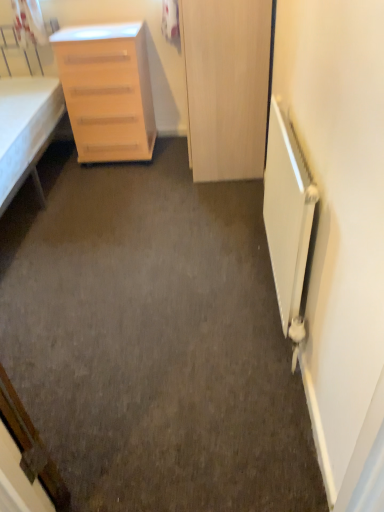
At what (x,y) coordinates should I click in order to perform the action: click on free space between light wood/finely finished chest of drawers at left and wooden door at center. Please return your answer as a coordinate pair (x, y). The width and height of the screenshot is (384, 512). Looking at the image, I should click on pos(157,163).